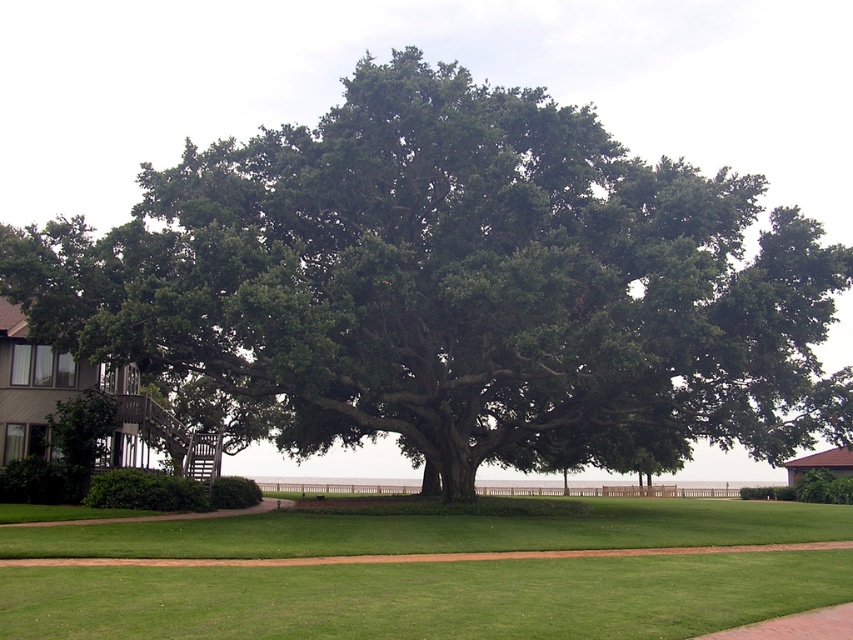
The image size is (853, 640). I want to click on green leafy tree at center, so click(457, 285).

Who is more distant from viewer, (x=758, y=284) or (x=834, y=573)?

The point (x=758, y=284) is behind.

At what (x,y) coordinates should I click in order to perform the action: click on green leafy tree at center. Please return your answer as a coordinate pair (x, y). This screenshot has width=853, height=640. Looking at the image, I should click on pyautogui.click(x=457, y=285).